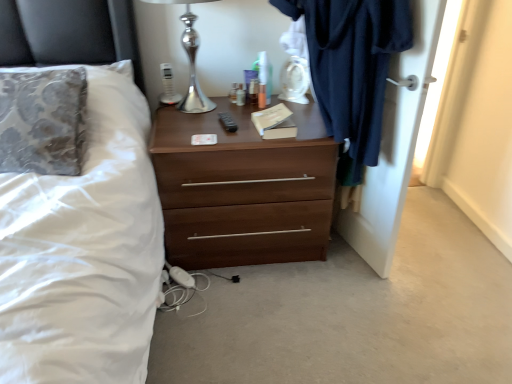
This screenshot has height=384, width=512. Identify the location of vacant space in front of brown wood chest of drawers at center. (272, 327).